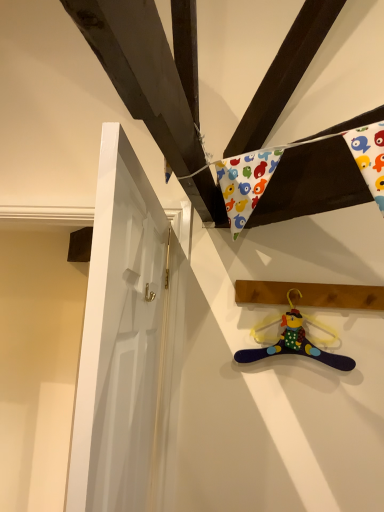
Question: Is white glossy door at left positioned before multicolored fabric hanger at lower right?

Choices:
 (A) no
 (B) yes

Answer: (B)

Question: From a real-world perspective, is white glossy door at left physically below multicolored fabric hanger at lower right?

Choices:
 (A) yes
 (B) no

Answer: (A)

Question: Considering the relative sizes of white glossy door at left and multicolored fabric hanger at lower right in the image provided, is white glossy door at left thinner than multicolored fabric hanger at lower right?

Choices:
 (A) yes
 (B) no

Answer: (B)

Question: Considering the relative positions of white glossy door at left and multicolored fabric hanger at lower right in the image provided, is white glossy door at left to the right of multicolored fabric hanger at lower right from the viewer's perspective?

Choices:
 (A) yes
 (B) no

Answer: (B)

Question: Does white glossy door at left have a greater height compared to multicolored fabric hanger at lower right?

Choices:
 (A) no
 (B) yes

Answer: (B)

Question: Is the depth of white glossy door at left greater than that of multicolored fabric hanger at lower right?

Choices:
 (A) no
 (B) yes

Answer: (A)

Question: From a real-world perspective, is multicolored fabric hanger at lower right under multicolored fabric hanger at lower right?

Choices:
 (A) no
 (B) yes

Answer: (B)

Question: Considering the relative sizes of multicolored fabric hanger at lower right and multicolored fabric hanger at lower right in the image provided, is multicolored fabric hanger at lower right taller than multicolored fabric hanger at lower right?

Choices:
 (A) yes
 (B) no

Answer: (A)

Question: Considering the relative positions of multicolored fabric hanger at lower right and multicolored fabric hanger at lower right in the image provided, is multicolored fabric hanger at lower right to the right of multicolored fabric hanger at lower right from the viewer's perspective?

Choices:
 (A) yes
 (B) no

Answer: (A)

Question: Considering the relative sizes of multicolored fabric hanger at lower right and multicolored fabric hanger at lower right in the image provided, is multicolored fabric hanger at lower right thinner than multicolored fabric hanger at lower right?

Choices:
 (A) yes
 (B) no

Answer: (B)

Question: Considering the relative positions of multicolored fabric hanger at lower right and multicolored fabric hanger at lower right in the image provided, is multicolored fabric hanger at lower right to the left of multicolored fabric hanger at lower right from the viewer's perspective?

Choices:
 (A) no
 (B) yes

Answer: (A)

Question: Are multicolored fabric hanger at lower right and multicolored fabric hanger at lower right far apart?

Choices:
 (A) no
 (B) yes

Answer: (A)

Question: From the image's perspective, is wooden plank at upper right located above white glossy door at left?

Choices:
 (A) no
 (B) yes

Answer: (B)